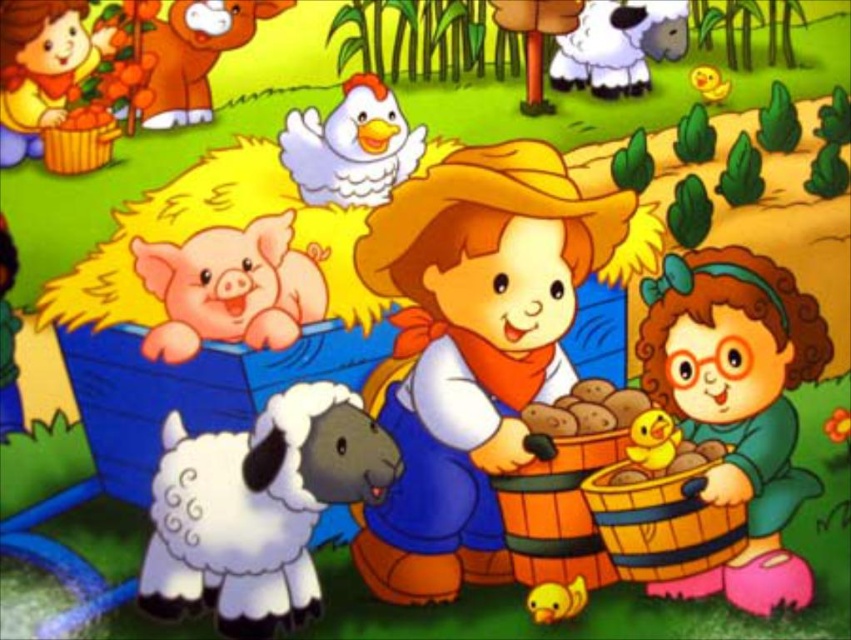
In the lively farm scene, there is a matte brown cowboy hat at center and a white woolen sheep at upper center. Which object takes up more space in the image?

The matte brown cowboy hat at center is bigger than the white woolen sheep at upper center, so it takes up more space in the image.

You are standing at the center of the farm scene. Where is the white fluffy sheep at lower left located in relation to your position?

The white fluffy sheep at lower left is located at point (x=256, y=508) relative to the image frame, which places it near the lower left corner of the scene.